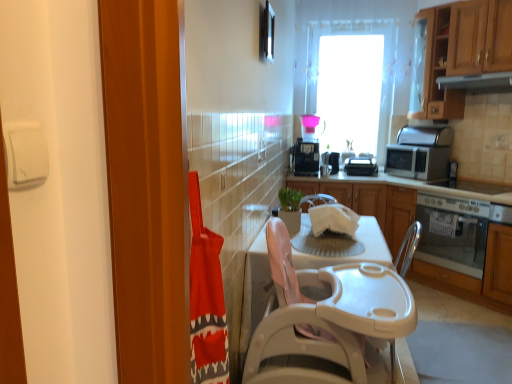
The image size is (512, 384). I want to click on white plastic table at center, which is the first table from front to back, so click(x=333, y=323).

The image size is (512, 384). Describe the element at coordinates (462, 50) in the screenshot. I see `wooden cabinet at upper right, which is counted as the second cabinetry, starting from the bottom` at that location.

This screenshot has width=512, height=384. Identify the location of white plastic sink at center. (325, 242).

Identify the location of silver metallic microwave at right, which appears as the 4th appliance when viewed from the left. (418, 162).

Find the location of a particular element. This screenshot has width=512, height=384. black plastic toaster at upper center, marked as the 4th appliance in a right-to-left arrangement is located at coordinates (305, 157).

In order to click on satin silver oven at lower right in this screenshot , I will do `click(453, 233)`.

The image size is (512, 384). What do you see at coordinates (453, 233) in the screenshot? I see `satin silver oven at lower right` at bounding box center [453, 233].

Locate an element on the screen. The height and width of the screenshot is (384, 512). white plastic table at center, which ranks as the 2th table in back-to-front order is located at coordinates (333, 323).

Relative to wooden cabinet at right, arranged as the 1th cabinetry when ordered from the bottom, is white plastic toaster at center, the third appliance from the left, in front or behind?

white plastic toaster at center, the third appliance from the left, is behind wooden cabinet at right, arranged as the 1th cabinetry when ordered from the bottom.

How distant is white plastic toaster at center, which is the second appliance in right-to-left order, from wooden cabinet at right, arranged as the 1th cabinetry when ordered from the bottom?

24.22 inches.

There is a wooden cabinet at right, arranged as the second cabinetry when viewed from the top. At what (x,y) coordinates should I click in order to perform the action: click on the 1st appliance above it (from a real-world perspective). Please return your answer as a coordinate pair (x, y). Looking at the image, I should click on (361, 166).

Looking at this image, how many degrees apart are the facing directions of white plastic toaster at center, the third appliance from the left, and wooden cabinet at right, arranged as the second cabinetry when viewed from the top?

There is a 38.6-degree angle between the facing directions of white plastic toaster at center, the third appliance from the left, and wooden cabinet at right, arranged as the second cabinetry when viewed from the top.

From the image's perspective, is black plastic toaster at upper center, which is counted as the 1th appliance, starting from the left, beneath white plastic sink at center?

No.

From a real-world perspective, does black plastic toaster at upper center, which is counted as the 1th appliance, starting from the left, sit lower than white plastic sink at center?

No.

Who is smaller, black plastic toaster at upper center, marked as the 4th appliance in a right-to-left arrangement, or white plastic sink at center?

Smaller between the two is white plastic sink at center.

How many degrees apart are the facing directions of wooden cabinet at right, arranged as the 1th cabinetry when ordered from the bottom, and wooden cabinet at upper right, which is counted as the second cabinetry, starting from the bottom?

They differ by 0.271 degrees in their facing directions.

Is wooden cabinet at upper right, which is the first cabinetry from top to bottom, at the back of wooden cabinet at right, arranged as the 1th cabinetry when ordered from the bottom?

No, wooden cabinet at right, arranged as the 1th cabinetry when ordered from the bottom, is not facing the opposite direction of wooden cabinet at upper right, which is the first cabinetry from top to bottom.

Considering the relative sizes of wooden cabinet at right, arranged as the second cabinetry when viewed from the top, and wooden cabinet at upper right, which is counted as the second cabinetry, starting from the bottom, in the image provided, is wooden cabinet at right, arranged as the second cabinetry when viewed from the top, wider than wooden cabinet at upper right, which is counted as the second cabinetry, starting from the bottom,?

Indeed, wooden cabinet at right, arranged as the second cabinetry when viewed from the top, has a greater width compared to wooden cabinet at upper right, which is counted as the second cabinetry, starting from the bottom.

Locate an element on the screen. The width and height of the screenshot is (512, 384). cabinetry positioned vertically above the wooden cabinet at right, arranged as the 1th cabinetry when ordered from the bottom (from a real-world perspective) is located at coordinates (462, 50).

Is point (324, 146) positioned behind point (405, 148)?

Yes.

Where is `window behind the silver metallic microwave at right, which is the first appliance in right-to-left order`? window behind the silver metallic microwave at right, which is the first appliance in right-to-left order is located at coordinates (335, 79).

Does transparent glass window at upper center have a lesser width compared to silver metallic microwave at right, which is the first appliance in right-to-left order?

Correct, the width of transparent glass window at upper center is less than that of silver metallic microwave at right, which is the first appliance in right-to-left order.

From the image's perspective, relative to silver metallic microwave at right, which appears as the 4th appliance when viewed from the left, is transparent glass window at upper center above or below?

From the image's perspective, transparent glass window at upper center appears above silver metallic microwave at right, which appears as the 4th appliance when viewed from the left.

Considering the positions of objects black plastic toaster at center, which is the 3th appliance from right to left, and satin silver exhaust hood at upper right in the image provided, who is more to the left, black plastic toaster at center, which is the 3th appliance from right to left, or satin silver exhaust hood at upper right?

From the viewer's perspective, black plastic toaster at center, which is the 3th appliance from right to left, appears more on the left side.

Considering the points (335, 159) and (476, 83), which point is behind, point (335, 159) or point (476, 83)?

Point (335, 159)

Which object is more forward, black plastic toaster at center, positioned as the second appliance in left-to-right order, or satin silver exhaust hood at upper right?

satin silver exhaust hood at upper right is more forward.

Does black plastic toaster at center, which is the 3th appliance from right to left, have a larger size compared to satin silver exhaust hood at upper right?

No, black plastic toaster at center, which is the 3th appliance from right to left, is not bigger than satin silver exhaust hood at upper right.

Can you tell me how much white plastic table at center, the 2th table viewed from the front, and black plastic toaster at upper center, which is counted as the 1th appliance, starting from the left, differ in facing direction?

They differ by 90.7 degrees in their facing directions.

Which is in front, white plastic table at center, the 2th table viewed from the front, or black plastic toaster at upper center, which is counted as the 1th appliance, starting from the left?

white plastic table at center, the 2th table viewed from the front.

Does white plastic table at center, the 2th table viewed from the front, have a larger size compared to black plastic toaster at upper center, which is counted as the 1th appliance, starting from the left?

Yes, white plastic table at center, the 2th table viewed from the front, is bigger than black plastic toaster at upper center, which is counted as the 1th appliance, starting from the left.

From a real-world perspective, relative to black plastic toaster at upper center, marked as the 4th appliance in a right-to-left arrangement, is white plastic table at center, positioned as the first table in back-to-front order, vertically above or below?

white plastic table at center, positioned as the first table in back-to-front order, is situated lower than black plastic toaster at upper center, marked as the 4th appliance in a right-to-left arrangement, in the real world.

Considering the sizes of objects white plastic table at center, which is the first table from front to back, and wooden cabinet at right, arranged as the 1th cabinetry when ordered from the bottom, in the image provided, who is thinner, white plastic table at center, which is the first table from front to back, or wooden cabinet at right, arranged as the 1th cabinetry when ordered from the bottom,?

wooden cabinet at right, arranged as the 1th cabinetry when ordered from the bottom.

Between white plastic table at center, which is the first table from front to back, and wooden cabinet at right, arranged as the 1th cabinetry when ordered from the bottom, which one has larger size?

wooden cabinet at right, arranged as the 1th cabinetry when ordered from the bottom, is bigger.

Is white plastic table at center, which is the first table from front to back, facing away from wooden cabinet at right, arranged as the 1th cabinetry when ordered from the bottom?

white plastic table at center, which is the first table from front to back, does not have its back to wooden cabinet at right, arranged as the 1th cabinetry when ordered from the bottom.

Identify the location of the 2nd table in front of the wooden cabinet at right, arranged as the second cabinetry when viewed from the top, starting your count from the anchor. (333, 323).

I want to click on cabinetry that is under the white plastic toaster at center, which is the second appliance in right-to-left order (from a real-world perspective), so click(x=393, y=197).

Find the location of a particular element. This screenshot has width=512, height=384. appliance that is the 4th one when counting upward from the white plastic sink at center (from the image's perspective) is located at coordinates (305, 157).

Considering their positions, is black plastic toaster at upper center, marked as the 4th appliance in a right-to-left arrangement, positioned further to satin silver oven at lower right than white plastic sink at center?

white plastic sink at center.

When comparing their distances from white plastic sink at center, does white plastic table at center, positioned as the first table in back-to-front order, or white plastic toaster at center, the third appliance from the left, seem further?

white plastic toaster at center, the third appliance from the left, lies further to white plastic sink at center than the other object.

Estimate the real-world distances between objects in this image. Which object is further from white plastic table at center, which is the first table from front to back, transparent glass window at upper center or satin silver exhaust hood at upper right?

transparent glass window at upper center is positioned further to the anchor white plastic table at center, which is the first table from front to back.

Estimate the real-world distances between objects in this image. Which object is further from transparent glass window at upper center, white plastic table at center, which is the first table from front to back, or black plastic toaster at center, which is the 3th appliance from right to left?

Among the two, white plastic table at center, which is the first table from front to back, is located further to transparent glass window at upper center.

Based on their spatial positions, is black plastic toaster at center, which is the 3th appliance from right to left, or satin silver oven at lower right further from wooden cabinet at upper right, which is the first cabinetry from top to bottom?

black plastic toaster at center, which is the 3th appliance from right to left, lies further to wooden cabinet at upper right, which is the first cabinetry from top to bottom, than the other object.

From the image, which object appears to be nearer to wooden cabinet at right, arranged as the 1th cabinetry when ordered from the bottom, black plastic toaster at center, which is the 3th appliance from right to left, or satin silver exhaust hood at upper right?

Among the two, black plastic toaster at center, which is the 3th appliance from right to left, is located nearer to wooden cabinet at right, arranged as the 1th cabinetry when ordered from the bottom.

When comparing their distances from transparent glass window at upper center, does black plastic toaster at upper center, marked as the 4th appliance in a right-to-left arrangement, or black plastic toaster at center, which is the 3th appliance from right to left, seem further?

The object further to transparent glass window at upper center is black plastic toaster at upper center, marked as the 4th appliance in a right-to-left arrangement.

Considering their positions, is transparent glass window at upper center positioned closer to satin silver exhaust hood at upper right than satin silver oven at lower right?

transparent glass window at upper center.

Image resolution: width=512 pixels, height=384 pixels. Identify the location of oven located between white plastic sink at center and black plastic toaster at center, which is the 3th appliance from right to left, in the depth direction. (453, 233).

I want to click on oven between wooden cabinet at right, arranged as the 1th cabinetry when ordered from the bottom, and black plastic toaster at center, which is the 3th appliance from right to left, along the z-axis, so click(453, 233).

Identify the location of sink between white plastic table at center, which ranks as the 2th table in back-to-front order, and silver metallic microwave at right, which appears as the 4th appliance when viewed from the left, in the front-back direction. The width and height of the screenshot is (512, 384). (325, 242).

You are a GUI agent. You are given a task and a screenshot of the screen. Output one action in this format:
    pyautogui.click(x=<x>, y=<y>)
    Task: Click on the sink between white plastic table at center, which ranks as the 2th table in back-to-front order, and wooden cabinet at right, arranged as the 1th cabinetry when ordered from the bottom, along the z-axis
    The image size is (512, 384).
    Given the screenshot: What is the action you would take?
    pyautogui.click(x=325, y=242)